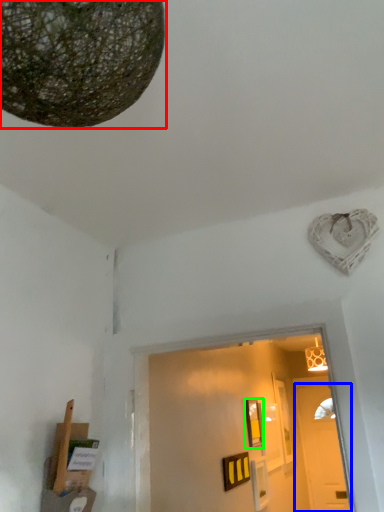
Question: Which object is the farthest from lamp (highlighted by a red box)? Choose among these: door (highlighted by a blue box) or picture frame (highlighted by a green box).

Choices:
 (A) door
 (B) picture frame

Answer: (A)